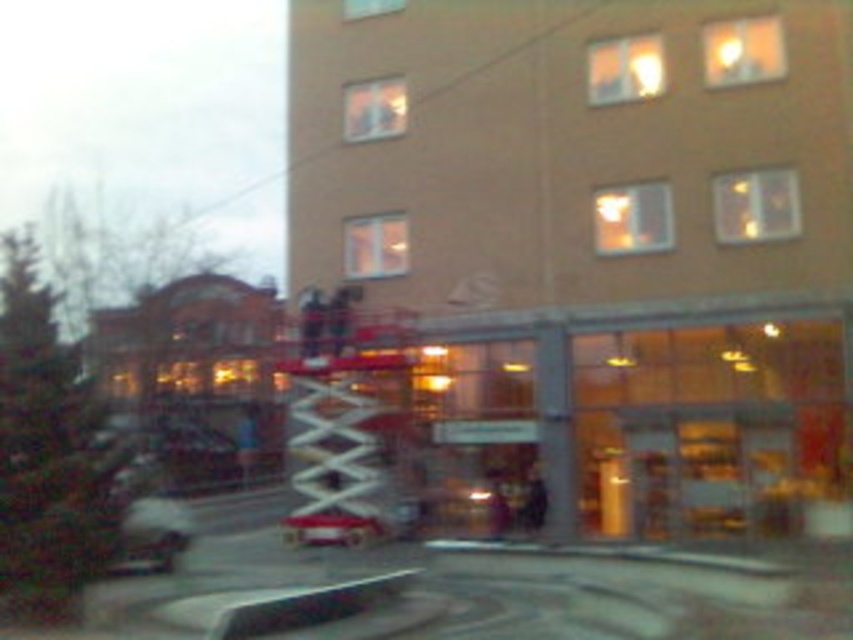
Is white metallic fire truck at center positioned in front of metallic silver car at lower left?

No, white metallic fire truck at center is further to the viewer.

Is white metallic fire truck at center bigger than metallic silver car at lower left?

No, white metallic fire truck at center is not bigger than metallic silver car at lower left.

Identify the location of white metallic fire truck at center. The height and width of the screenshot is (640, 853). (345, 433).